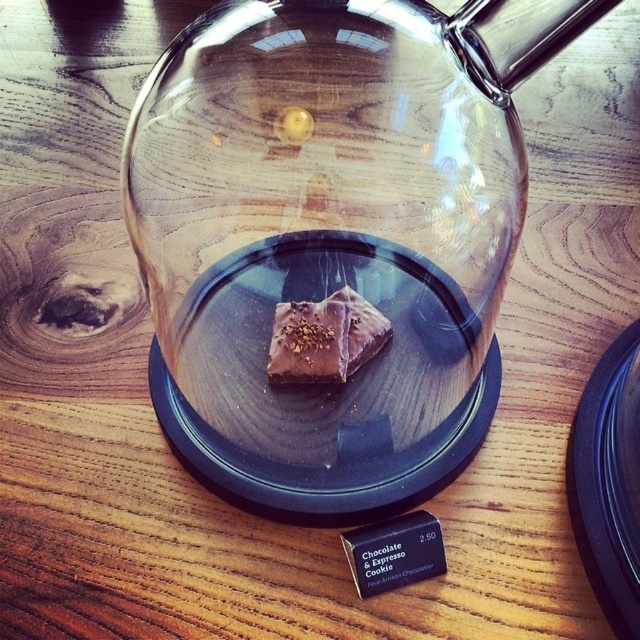
Question: Is chocolatesmoothsquare at center to the right of dark chocolate bar at center from the viewer's perspective?

Choices:
 (A) no
 (B) yes

Answer: (A)

Question: Does black glossy plate at bottom right appear over dark chocolate bar at center?

Choices:
 (A) no
 (B) yes

Answer: (B)

Question: Which object is the closest to the transparent glass teapot at center?

Choices:
 (A) black glossy plate at bottom right
 (B) dark chocolate bar at center

Answer: (B)

Question: Which is nearer to the chocolatesmoothsquare at center?

Choices:
 (A) transparent glass teapot at center
 (B) black glossy plate at bottom right
 (C) dark chocolate bar at center

Answer: (A)

Question: Is black glossy plate at bottom right wider than chocolatesmoothsquare at center?

Choices:
 (A) no
 (B) yes

Answer: (B)

Question: Which of the following is the closest to the observer?

Choices:
 (A) (349, 337)
 (B) (180, 381)

Answer: (A)